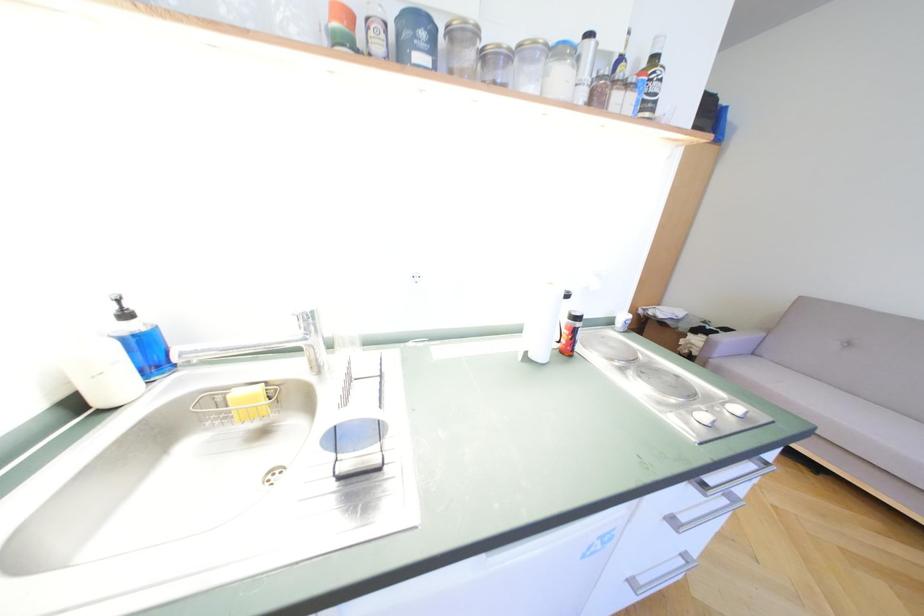
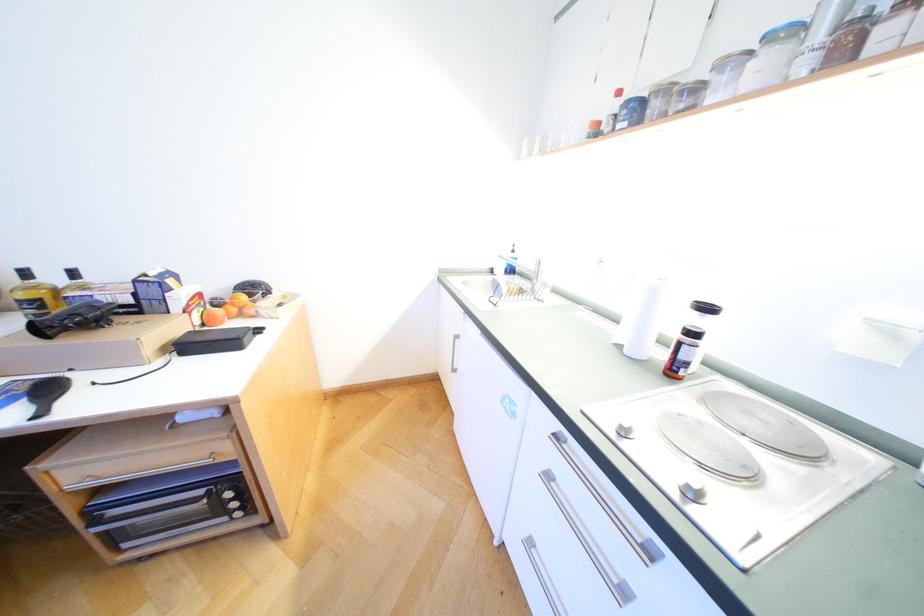
The first image is from the beginning of the video and the second image is from the end. How did the camera likely rotate when shooting the video?

The camera's rotation is toward left-down.